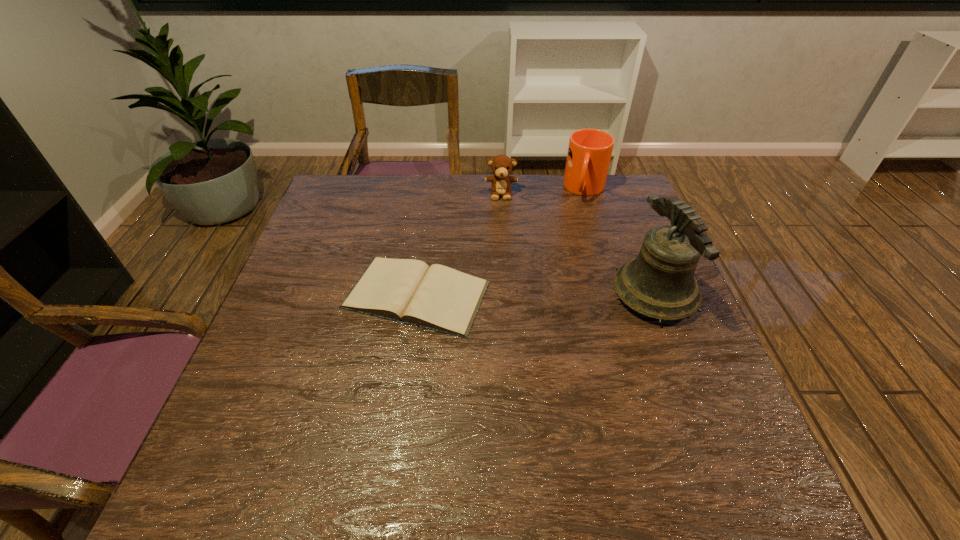
Identify the location of free space located 0.150m on the handle side of the mug. The image size is (960, 540). (580, 235).

Image resolution: width=960 pixels, height=540 pixels. Find the location of `vacant region located 0.310m on the handle side of the mug`. vacant region located 0.310m on the handle side of the mug is located at coordinates (574, 274).

Image resolution: width=960 pixels, height=540 pixels. I want to click on teddy bear present at the far edge, so click(x=501, y=166).

Locate an element on the screen. The height and width of the screenshot is (540, 960). mug that is at the far edge is located at coordinates (589, 153).

The height and width of the screenshot is (540, 960). I want to click on object that is at the left edge, so [x=440, y=298].

Where is `bell that is positioned at the right edge`? bell that is positioned at the right edge is located at coordinates (659, 283).

Locate an element on the screen. Image resolution: width=960 pixels, height=540 pixels. mug located in the right edge section of the desktop is located at coordinates (589, 153).

Locate an element on the screen. The width and height of the screenshot is (960, 540). object that is at the far right corner is located at coordinates (589, 153).

Locate an element on the screen. This screenshot has height=540, width=960. free space at the far edge of the desktop is located at coordinates (552, 178).

The image size is (960, 540). I want to click on vacant space at the left edge of the desktop, so click(315, 253).